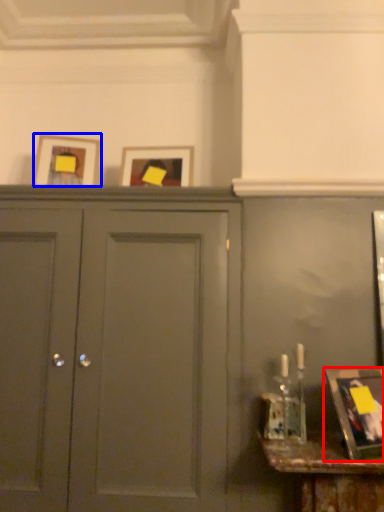
Question: Which object is further to the camera taking this photo, picture frame (highlighted by a red box) or picture frame (highlighted by a blue box)?

Choices:
 (A) picture frame
 (B) picture frame

Answer: (B)